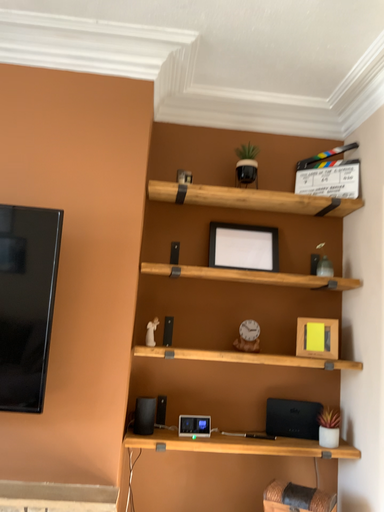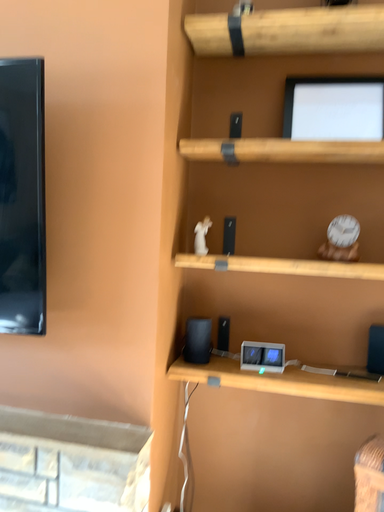
Question: How did the camera likely rotate when shooting the video?

Choices:
 (A) rotated left
 (B) rotated right

Answer: (A)